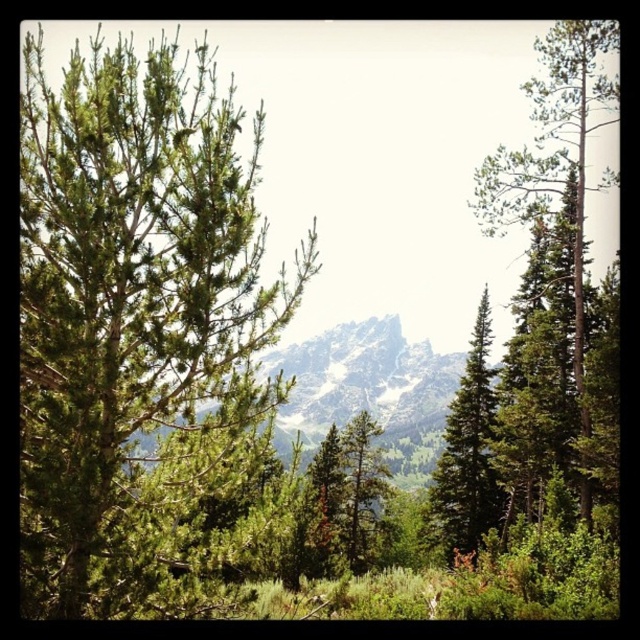
Is green textured mountain at center further to camera compared to green textured pine tree at right?

Yes.

The image size is (640, 640). What do you see at coordinates (369, 390) in the screenshot?
I see `green textured mountain at center` at bounding box center [369, 390].

Where is `green textured mountain at center`? This screenshot has width=640, height=640. green textured mountain at center is located at coordinates (369, 390).

Between green needle-like at left and green matte tree at center, which one is positioned higher?

green needle-like at left is above.

Which is more to the left, green needle-like at left or green matte tree at center?

green needle-like at left is more to the left.

Is point (204, 188) closer to viewer compared to point (342, 486)?

Yes.

Image resolution: width=640 pixels, height=640 pixels. Identify the location of green needle-like at left. (144, 336).

Which is behind, point (321, 362) or point (348, 522)?

The point (321, 362) is behind.

Does green textured mountain at center have a smaller size compared to green matte tree at center?

No.

Find the location of a particular element. The width and height of the screenshot is (640, 640). green textured mountain at center is located at coordinates (369, 390).

You are a GUI agent. You are given a task and a screenshot of the screen. Output one action in this format:
    pyautogui.click(x=<x>, y=<y>)
    Task: Click on the green textured mountain at center
    
    Given the screenshot: What is the action you would take?
    pyautogui.click(x=369, y=390)